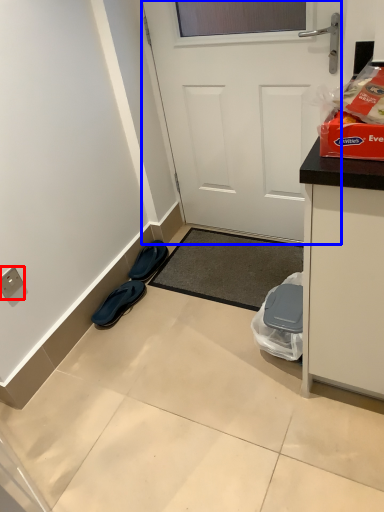
Question: Which point is further to the camera, electric outlet (highlighted by a red box) or door (highlighted by a blue box)?

Choices:
 (A) electric outlet
 (B) door

Answer: (A)